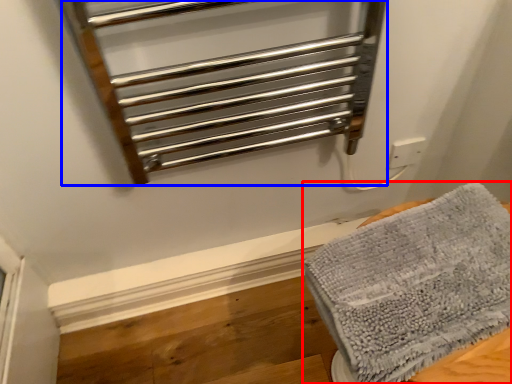
Question: Which of the following is the farthest to the observer, towel (highlighted by a red box) or cage (highlighted by a blue box)?

Choices:
 (A) towel
 (B) cage

Answer: (A)